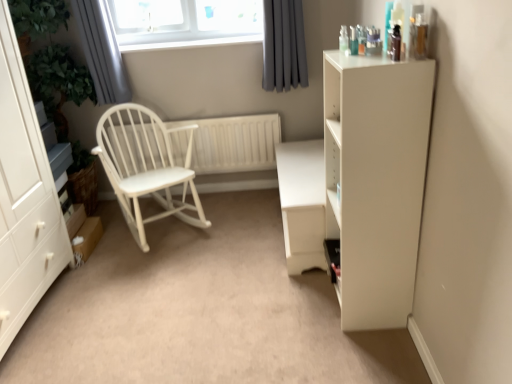
The image size is (512, 384). Find the location of `vacant area to the left of white matte table at center`. vacant area to the left of white matte table at center is located at coordinates (226, 248).